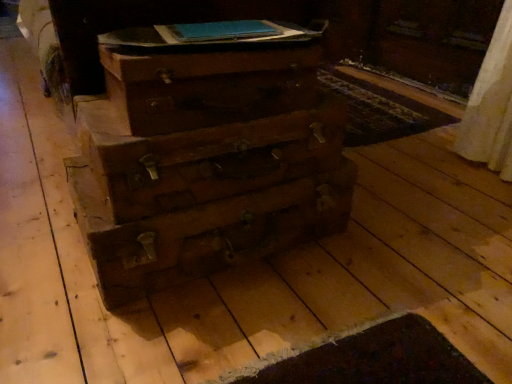
Question: Is wooden drawer at center, the 1th drawer viewed from the top, thinner than blue paper book at upper center?

Choices:
 (A) yes
 (B) no

Answer: (B)

Question: From the image's perspective, is wooden drawer at center, which is counted as the 2th drawer, starting from the bottom, over blue paper book at upper center?

Choices:
 (A) yes
 (B) no

Answer: (B)

Question: Is wooden drawer at center, which is counted as the 2th drawer, starting from the bottom, positioned behind blue paper book at upper center?

Choices:
 (A) no
 (B) yes

Answer: (A)

Question: Can you confirm if wooden drawer at center, the 1th drawer viewed from the top, is taller than blue paper book at upper center?

Choices:
 (A) no
 (B) yes

Answer: (B)

Question: Would you consider wooden drawer at center, the 1th drawer viewed from the top, to be distant from blue paper book at upper center?

Choices:
 (A) yes
 (B) no

Answer: (B)

Question: From a real-world perspective, is blue paper book at upper center physically located above or below wooden chest of drawers at center?

Choices:
 (A) above
 (B) below

Answer: (A)

Question: Looking at the image, does blue paper book at upper center seem bigger or smaller compared to wooden chest of drawers at center?

Choices:
 (A) big
 (B) small

Answer: (B)

Question: Is point (200, 44) positioned closer to the camera than point (264, 175)?

Choices:
 (A) farther
 (B) closer

Answer: (B)

Question: Looking at their shapes, would you say blue paper book at upper center is wider or thinner than wooden chest of drawers at center?

Choices:
 (A) wide
 (B) thin

Answer: (B)

Question: Considering the positions of blue paper book at upper center and wooden drawer at center, which appears as the second drawer when viewed from the top, in the image, is blue paper book at upper center wider or thinner than wooden drawer at center, which appears as the second drawer when viewed from the top,?

Choices:
 (A) thin
 (B) wide

Answer: (A)

Question: From a real-world perspective, relative to wooden drawer at center, which appears as the second drawer when viewed from the top, is blue paper book at upper center vertically above or below?

Choices:
 (A) above
 (B) below

Answer: (A)

Question: Is point (168, 38) positioned closer to the camera than point (145, 160)?

Choices:
 (A) farther
 (B) closer

Answer: (A)

Question: From the image's perspective, relative to wooden drawer at center, which appears as the second drawer when viewed from the top, is blue paper book at upper center above or below?

Choices:
 (A) above
 (B) below

Answer: (A)

Question: Is point (178, 135) positioned closer to the camera than point (214, 162)?

Choices:
 (A) closer
 (B) farther

Answer: (A)

Question: In terms of size, does wooden chest of drawers at center appear bigger or smaller than wooden drawer at center, the first drawer from the bottom?

Choices:
 (A) big
 (B) small

Answer: (A)